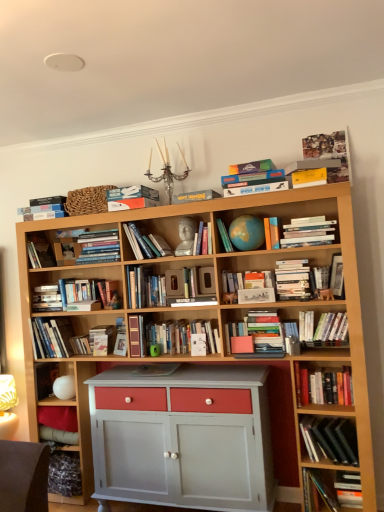
Question: From the image's perspective, is matte blue globe at center, which appears as the 7th book when viewed from the left, located above or below hardcover books at center, the tenth book when ordered from right to left?

Choices:
 (A) below
 (B) above

Answer: (B)

Question: Which is correct: matte blue globe at center, acting as the 7th book starting from the right, is inside hardcover books at center, which is counted as the 4th book, starting from the left, or outside of it?

Choices:
 (A) outside
 (B) inside

Answer: (A)

Question: Which of these objects is positioned farthest from the hardcover books at upper center, the tenth book viewed from the left?

Choices:
 (A) black matte book at lower right, the second book positioned from the right
 (B) hardcover book at lower right, the first book positioned from the right
 (C) hardcover books at center, the 11th book from the left
 (D) hardcover book at upper center, the 9th book in the left-to-right sequence
 (E) hardcover book at left, which is the first book from left to right

Answer: (E)

Question: Which object is positioned farthest from the hardcover books at left, positioned as the 3th book in left-to-right order?

Choices:
 (A) hardcover books at upper center, the 4th book viewed from the right
 (B) hardcover books at center, arranged as the sixth book when viewed from the right
 (C) black matte book at lower right, the second book positioned from the right
 (D) hardcover books at center, the third book viewed from the right
 (E) hardcover book at upper center, which ranks as the first paperback book in top-to-bottom order

Answer: (A)